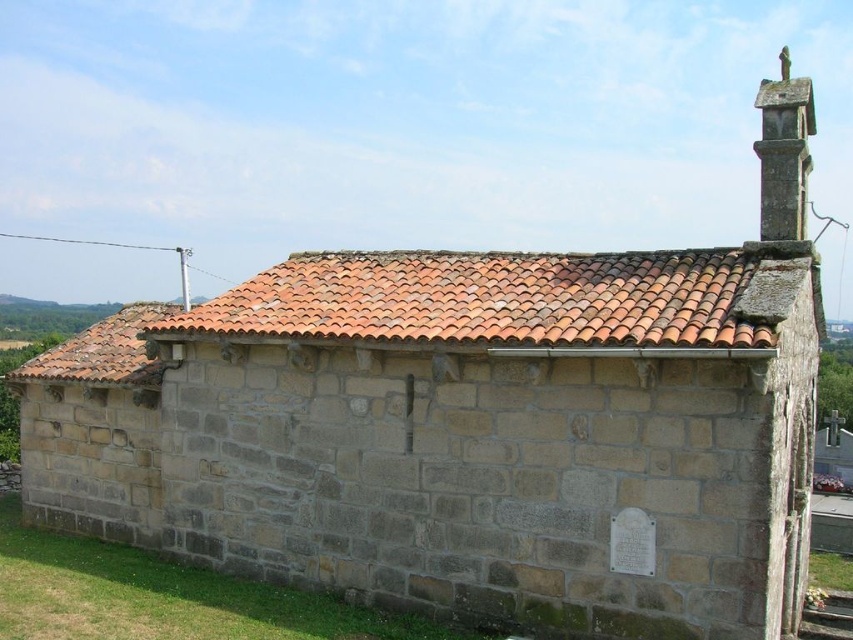
Between terracotta tiles at upper center and smooth stone chimney at upper right, which one has less height?

terracotta tiles at upper center

Can you confirm if terracotta tiles at upper center is positioned to the left of smooth stone chimney at upper right?

Indeed, terracotta tiles at upper center is positioned on the left side of smooth stone chimney at upper right.

Is point (587, 324) farther from camera compared to point (802, 109)?

No, it is in front of (802, 109).

Locate an element on the screen. The height and width of the screenshot is (640, 853). terracotta tiles at upper center is located at coordinates pos(492,300).